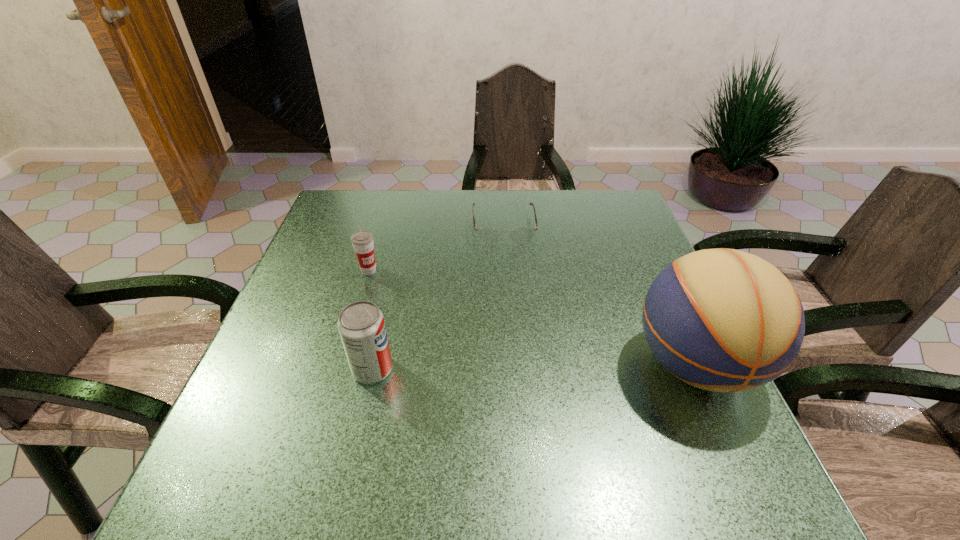
In order to click on free spot on the desktop that is between the soda and the tallest object and is positioned on the side of the cup with the logo in this screenshot , I will do `click(491, 367)`.

The width and height of the screenshot is (960, 540). Identify the location of vacant space on the desktop that is between the soda and the rightmost object and is positioned on the front-facing side of the spectacles. (519, 367).